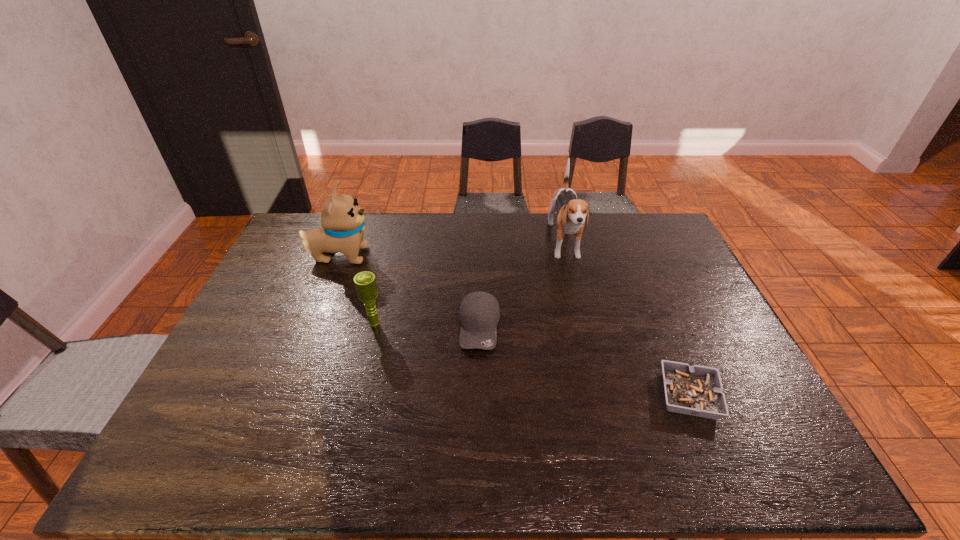
Locate an element on the screen. Image resolution: width=960 pixels, height=540 pixels. the second object from right to left is located at coordinates (572, 213).

Find the location of `the left puppy`. the left puppy is located at coordinates [342, 219].

The image size is (960, 540). I want to click on the fourth object from right to left, so click(365, 283).

Where is `the third shortest object`? the third shortest object is located at coordinates (365, 283).

Locate an element on the screen. This screenshot has height=540, width=960. the third object from right to left is located at coordinates (479, 313).

Identify the location of baseball cap. Image resolution: width=960 pixels, height=540 pixels. (479, 313).

Find the location of a particular element. The height and width of the screenshot is (540, 960). ashtray is located at coordinates (696, 390).

The height and width of the screenshot is (540, 960). In order to click on the shortest object in this screenshot , I will do `click(696, 390)`.

This screenshot has width=960, height=540. I want to click on free location located 0.280m at the face of the fourth object from left to right, so click(587, 338).

The height and width of the screenshot is (540, 960). What are the coordinates of `free space located on the face of the leftmost object` in the screenshot? It's located at (439, 255).